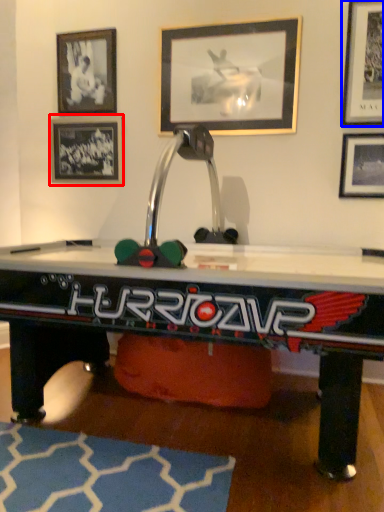
Question: Which of the following is the closest to the observer, picture frame (highlighted by a red box) or picture frame (highlighted by a blue box)?

Choices:
 (A) picture frame
 (B) picture frame

Answer: (B)